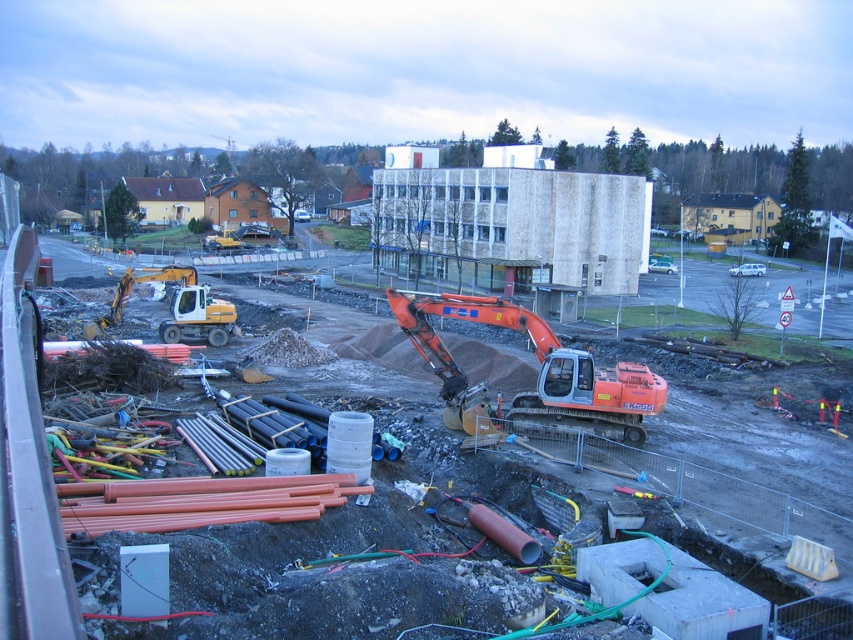
Is orange metallic excavator at center above matte yellow excavator at center-left?

No.

Which is below, orange metallic excavator at center or matte yellow excavator at center-left?

orange metallic excavator at center

What do you see at coordinates (538, 369) in the screenshot? I see `orange metallic excavator at center` at bounding box center [538, 369].

Locate an element on the screen. orange metallic excavator at center is located at coordinates (538, 369).

Is orange metallic excavator at center thinner than orange metallic pipes at center?

Correct, orange metallic excavator at center's width is less than orange metallic pipes at center's.

Consider the image. Does orange metallic excavator at center have a greater width compared to orange metallic pipes at center?

Incorrect, orange metallic excavator at center's width does not surpass orange metallic pipes at center's.

You are a GUI agent. You are given a task and a screenshot of the screen. Output one action in this format:
    pyautogui.click(x=<x>, y=<y>)
    Task: Click on the orange metallic excavator at center
    The height and width of the screenshot is (640, 853).
    Given the screenshot: What is the action you would take?
    pyautogui.click(x=538, y=369)

Identify the location of orange metallic excavator at center. (538, 369).

You are a GUI agent. You are given a task and a screenshot of the screen. Output one action in this format:
    pyautogui.click(x=<x>, y=<y>)
    Task: Click on the orange metallic pipes at center
    The image size is (853, 640).
    Given the screenshot: What is the action you would take?
    pyautogui.click(x=7, y=353)

Where is `orange metallic pipes at center`? orange metallic pipes at center is located at coordinates [7, 353].